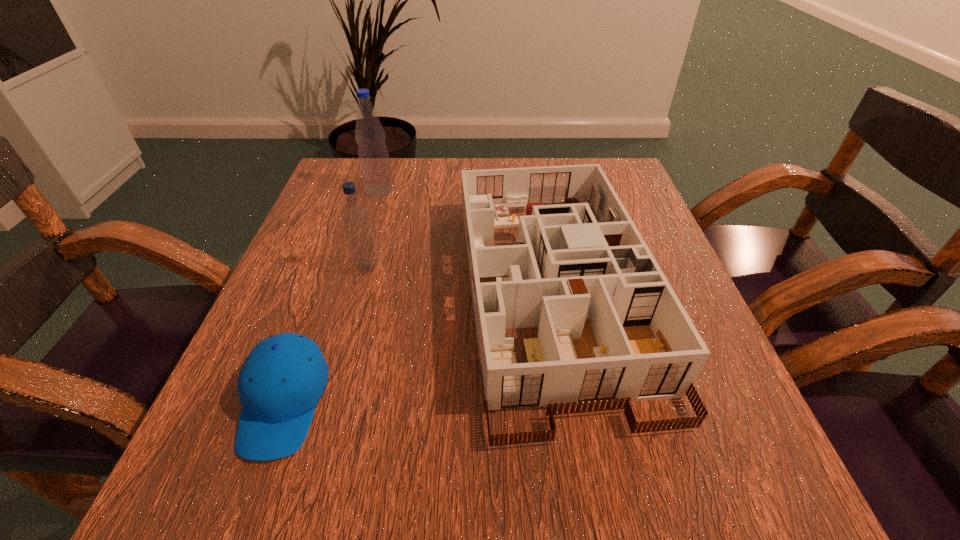
You are a GUI agent. You are given a task and a screenshot of the screen. Output one action in this format:
    pyautogui.click(x=<x>, y=<y>)
    Task: Click on the tallest object
    Image resolution: width=960 pixels, height=540 pixels.
    Given the screenshot: What is the action you would take?
    pos(373,155)

Locate an element on the screen. the taller water bottle is located at coordinates (373, 155).

This screenshot has width=960, height=540. What are the coordinates of `the second tallest object` in the screenshot? It's located at (355, 217).

Locate an element on the screen. The image size is (960, 540). the shorter water bottle is located at coordinates (355, 217).

Locate an element on the screen. This screenshot has width=960, height=540. the second shortest object is located at coordinates (612, 330).

Locate an element on the screen. The width and height of the screenshot is (960, 540). the rightmost object is located at coordinates (612, 330).

At what (x,y) coordinates should I click in order to perform the action: click on the shortest object. Please return your answer as a coordinate pair (x, y). The height and width of the screenshot is (540, 960). Looking at the image, I should click on (283, 378).

Where is `vacant space located 0.140m on the front of the tallest object`? The height and width of the screenshot is (540, 960). vacant space located 0.140m on the front of the tallest object is located at coordinates (366, 234).

The width and height of the screenshot is (960, 540). Find the location of `free region located 0.090m on the left of the second tallest object`. free region located 0.090m on the left of the second tallest object is located at coordinates (308, 268).

The image size is (960, 540). I want to click on vacant space located on the left of the rightmost object, so click(312, 291).